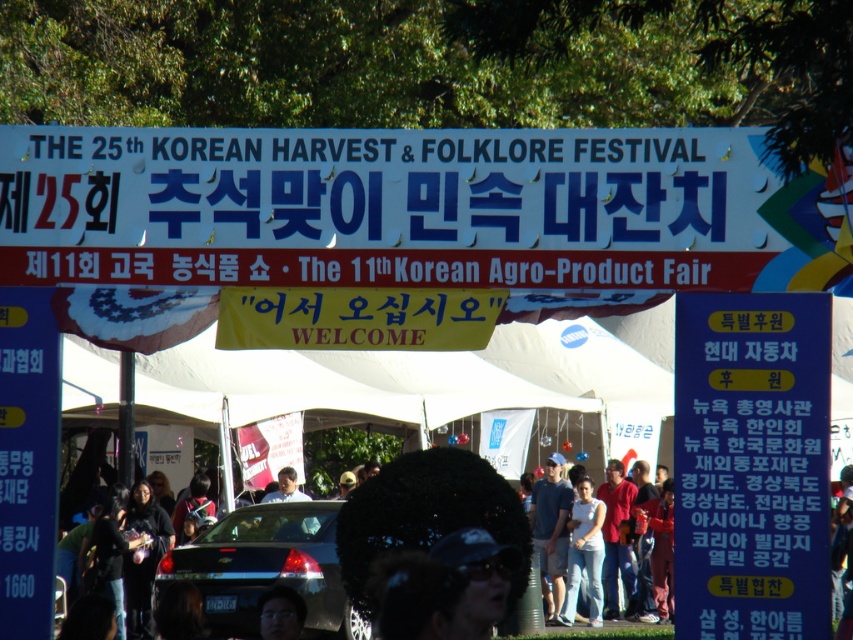
Question: Estimate the real-world distances between objects in this image. Which object is closer to the blue paper sign at center?

Choices:
 (A) white cotton shirt at center
 (B) blue denim jeans at center

Answer: (A)

Question: Can you confirm if white plastic banner at upper center is positioned above blue denim jeans at center?

Choices:
 (A) no
 (B) yes

Answer: (B)

Question: Does blue denim jeans at center have a larger size compared to white cotton shirt at center?

Choices:
 (A) yes
 (B) no

Answer: (B)

Question: Considering the relative positions of blue plastic sign at left and white cotton shirt at center in the image provided, where is blue plastic sign at left located with respect to white cotton shirt at center?

Choices:
 (A) right
 (B) left

Answer: (B)

Question: Which of these objects is positioned farthest from the blue denim jeans at center?

Choices:
 (A) white cotton shirt at center
 (B) blue paper sign at center
 (C) blue plastic sign at left

Answer: (B)

Question: Among these objects, which one is nearest to the camera?

Choices:
 (A) white cotton shirt at center
 (B) blue denim jeans at center
 (C) blue paper sign at center

Answer: (C)